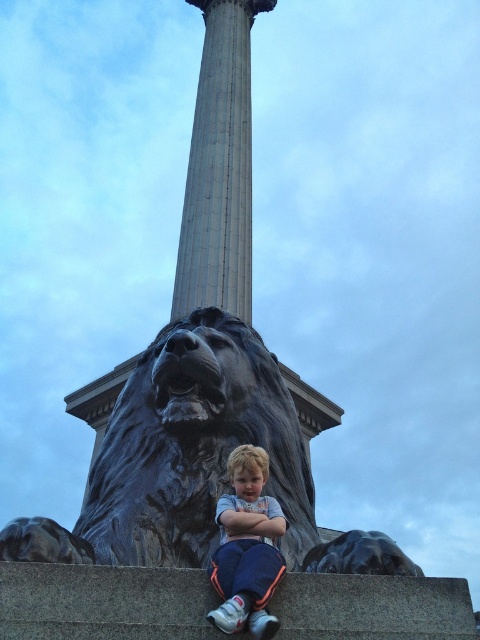
You are an architect designing a new plaza and want to place a statue and a column similar to the ones in the image. The statue must be placed in front of the column. Based on the sizes of the polished bronze lion at center and the gray marble column at center, which one should be placed in front to ensure the column is visible behind it?

The polished bronze lion at center is smaller than the gray marble column at center, so to ensure the column is visible behind it, the polished bronze lion at center should be placed in front.